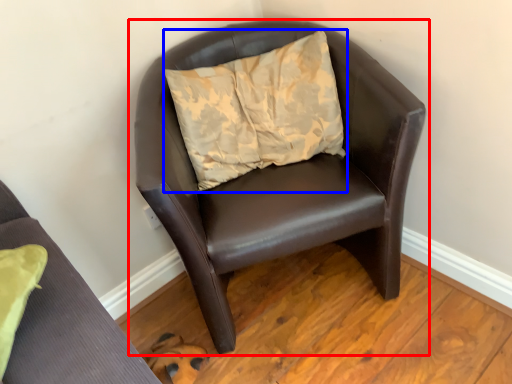
Question: Which point is closer to the camera, chair (highlighted by a red box) or pillow (highlighted by a blue box)?

Choices:
 (A) chair
 (B) pillow

Answer: (A)